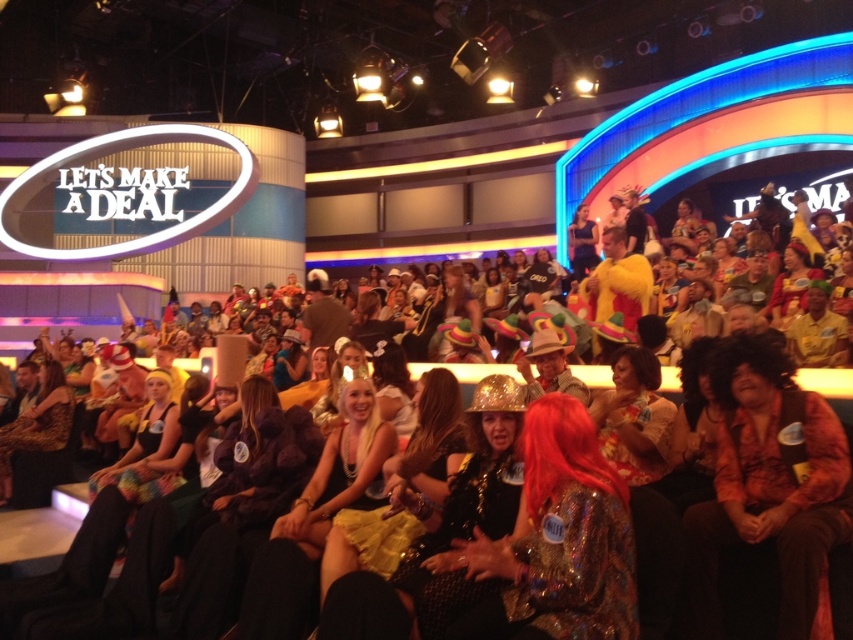
Question: Estimate the real-world distances between objects in this image. Which object is closer to the shiny metallic hat at center?

Choices:
 (A) orange textured shirt at center
 (B) shiny metallic hats at center

Answer: (A)

Question: Does orange textured shirt at center lie in front of shiny metallic hats at center?

Choices:
 (A) no
 (B) yes

Answer: (B)

Question: Can you confirm if orange textured shirt at center is positioned to the left of shiny metallic hats at center?

Choices:
 (A) yes
 (B) no

Answer: (B)

Question: Does orange textured shirt at center have a larger size compared to shiny metallic hats at center?

Choices:
 (A) yes
 (B) no

Answer: (B)

Question: Among these points, which one is farthest from the camera?

Choices:
 (A) (22, 445)
 (B) (703, 496)

Answer: (A)

Question: Which point is closer to the camera taking this photo?

Choices:
 (A) (521, 387)
 (B) (0, 499)
 (C) (601, 481)
 (D) (779, 608)

Answer: (C)